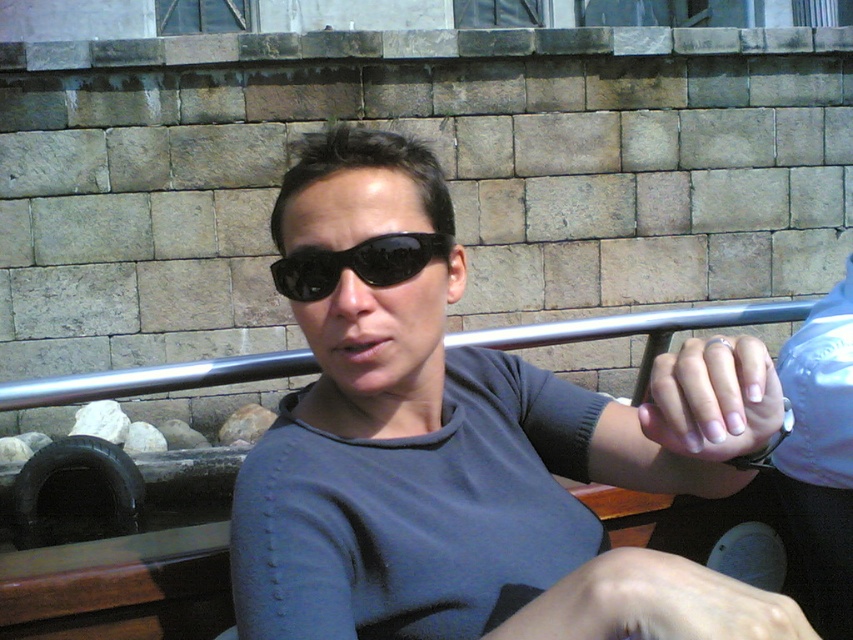
Question: In this image, where is matte black sunglasses at center located relative to white polished nails at center?

Choices:
 (A) right
 (B) left

Answer: (B)

Question: Which of the following is the closest to the observer?

Choices:
 (A) (538, 508)
 (B) (427, 248)

Answer: (B)

Question: Which point appears farthest from the camera in this image?

Choices:
 (A) (709, 634)
 (B) (724, 384)

Answer: (B)

Question: Estimate the real-world distances between objects in this image. Which object is closer to the pale skin at lower right?

Choices:
 (A) white polished nails at center
 (B) matte black sunglasses at center
 (C) black matte sunglasses at center

Answer: (A)

Question: Is matte black sunglasses at center above black matte sunglasses at center?

Choices:
 (A) yes
 (B) no

Answer: (B)

Question: Is matte black sunglasses at center further to camera compared to black matte sunglasses at center?

Choices:
 (A) yes
 (B) no

Answer: (B)